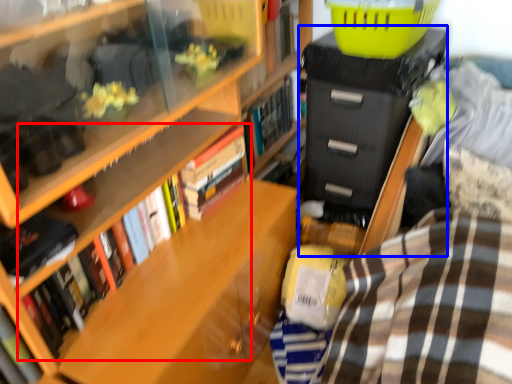
Question: Which of the following is the closest to the observer, book (highlighted by a red box) or file cabinet (highlighted by a blue box)?

Choices:
 (A) book
 (B) file cabinet

Answer: (A)